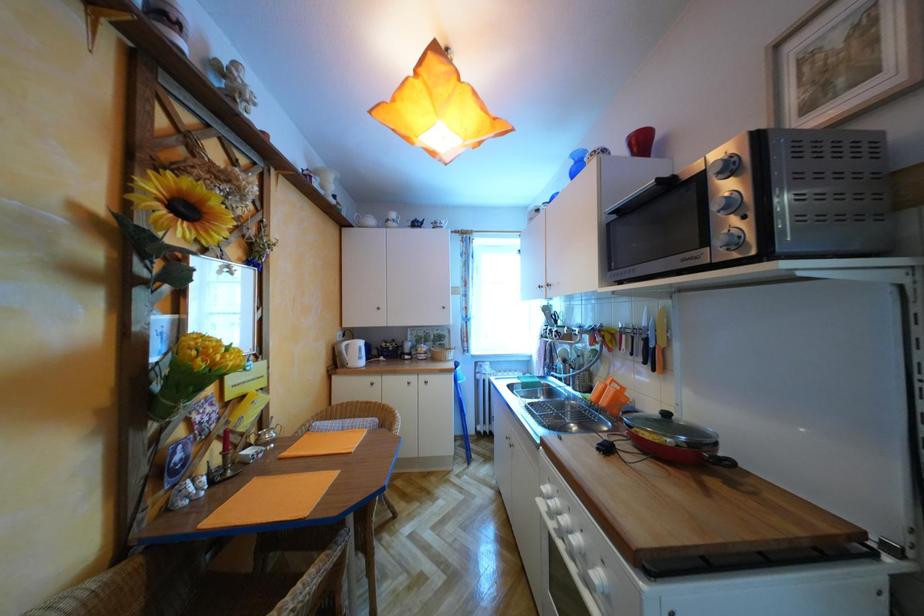
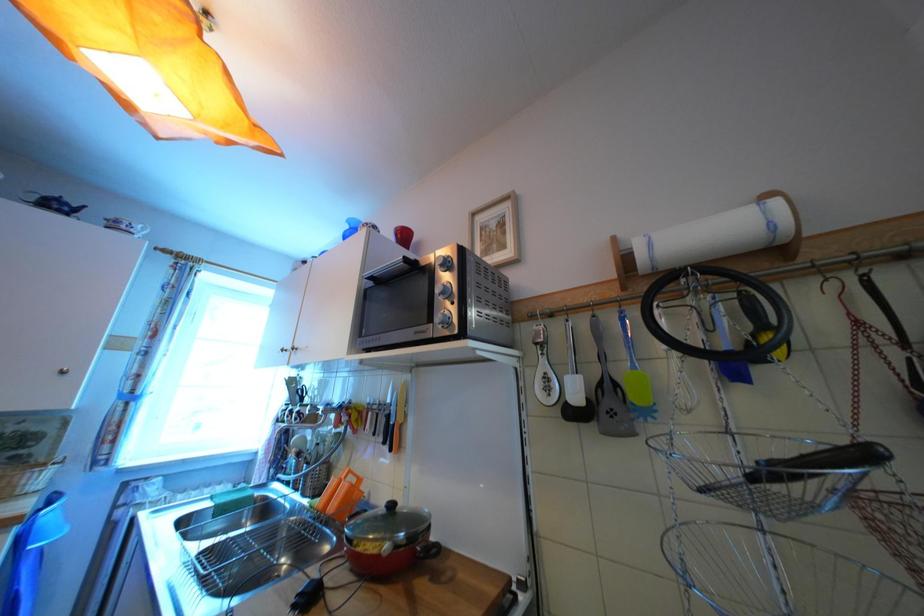
First-person continuous shooting, in which direction is the camera rotating?

The rotation direction of the camera is right-up.